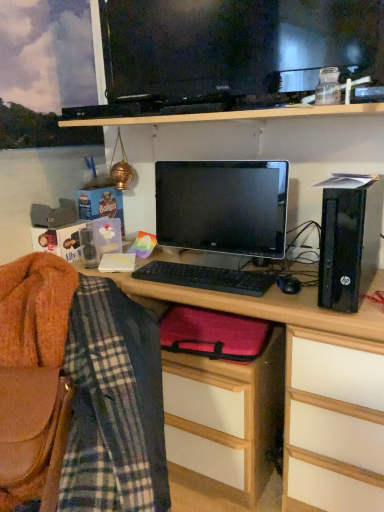
Locate an element on the screen. free space to the left of black plastic mouse at center is located at coordinates (250, 290).